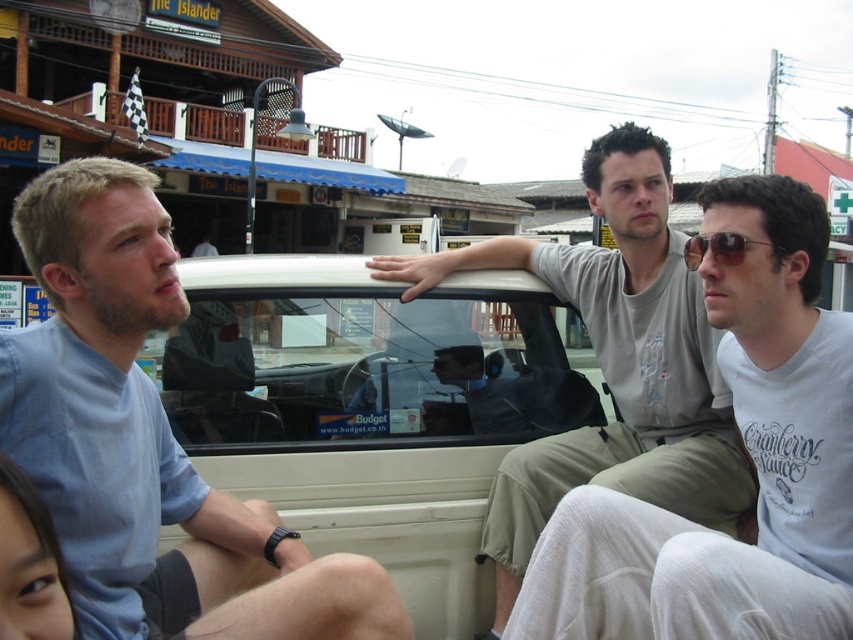
Question: Does light blue shirt at left have a larger size compared to matte gray pickup truck at center?

Choices:
 (A) no
 (B) yes

Answer: (A)

Question: Among these points, which one is farthest from the camera?

Choices:
 (A) (817, 260)
 (B) (538, 458)
 (C) (82, 312)

Answer: (B)

Question: Which point is closer to the camera?

Choices:
 (A) (763, 534)
 (B) (74, 173)
 (C) (666, 468)
 (D) (697, 241)

Answer: (B)

Question: Does light blue shirt at left have a greater width compared to sunglasses at center?

Choices:
 (A) yes
 (B) no

Answer: (A)

Question: Considering the real-world distances, which object is closest to the sunglasses at center?

Choices:
 (A) matte gray pickup truck at center
 (B) light blue shirt at left

Answer: (A)

Question: Can you confirm if light blue shirt at left is thinner than white fabric pickup truck at center?

Choices:
 (A) yes
 (B) no

Answer: (B)